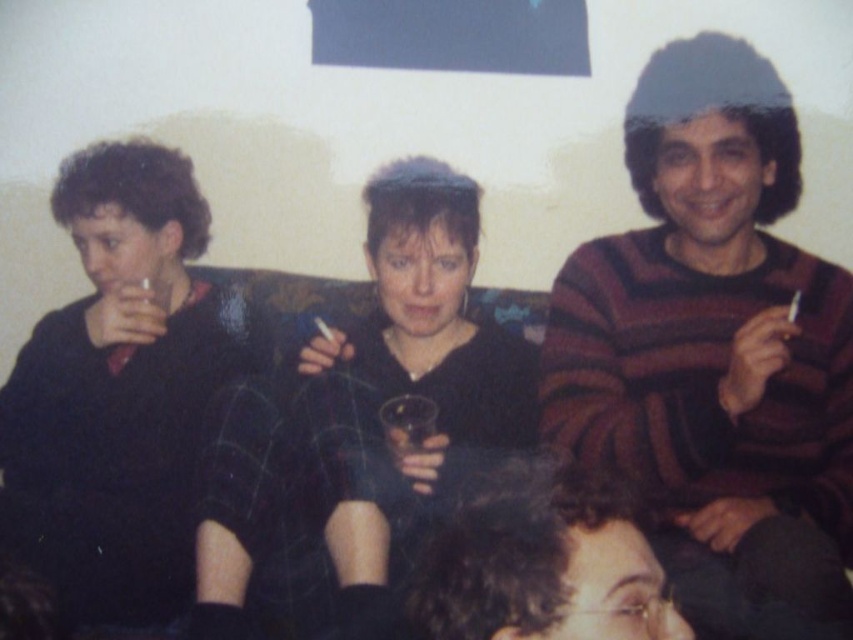
Question: Does matte black sweater at left appear on the left side of dark curly hair at lower center?

Choices:
 (A) yes
 (B) no

Answer: (A)

Question: Is striped sweater at right below black matte sweater at center?

Choices:
 (A) no
 (B) yes

Answer: (A)

Question: Can you confirm if dark curly hair at lower center is positioned below translucent glass at center?

Choices:
 (A) yes
 (B) no

Answer: (A)

Question: Which object appears closest to the camera in this image?

Choices:
 (A) matte black sweater at left
 (B) striped sweater at right
 (C) translucent glass at center
 (D) black matte sweater at center

Answer: (B)

Question: Among these points, which one is farthest from the camera?

Choices:
 (A) (764, 179)
 (B) (374, 348)
 (C) (387, 400)
 (D) (601, 513)

Answer: (B)

Question: Which is farther from the black matte sweater at center?

Choices:
 (A) striped sweater at right
 (B) dark curly hair at lower center

Answer: (B)